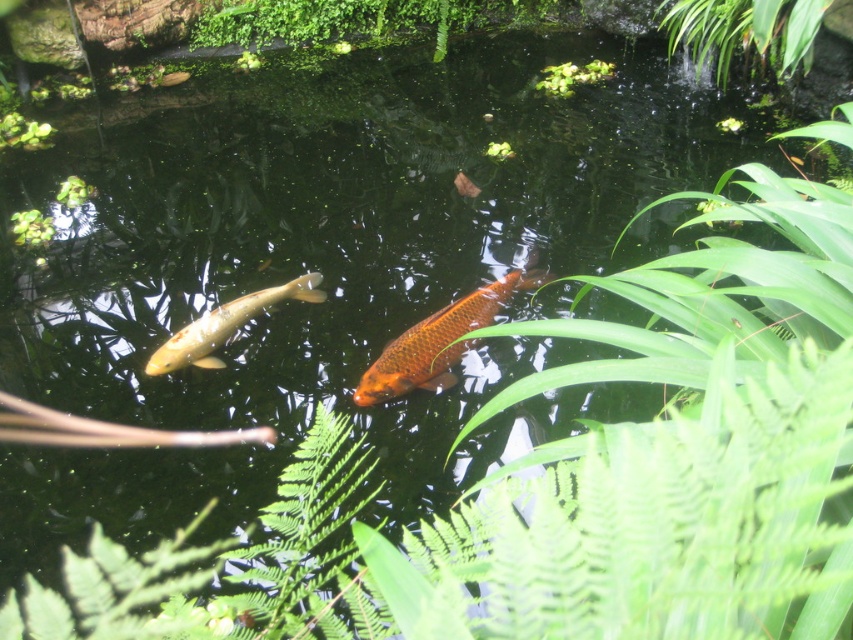
Consider the image. You are standing at the edge of the pond and see the green leafy plant at upper right and the golden glossy fish at center. Which object is positioned to the right side of the other?

The green leafy plant at upper right is positioned to the right of the golden glossy fish at center.

You are a gardener planning to trim the green leafy plant at upper right and the green leafy plant at upper center. Which plant requires more horizontal space due to its width?

The green leafy plant at upper right might require more horizontal space because it is wider than the green leafy plant at upper center.